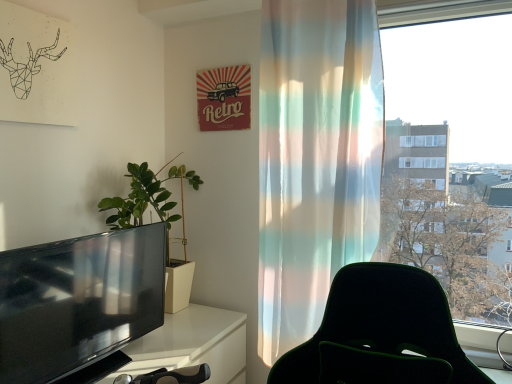
Question: Does point (53, 375) appear closer or farther from the camera than point (378, 218)?

Choices:
 (A) closer
 (B) farther

Answer: (A)

Question: From the image's perspective, is black glossy television at left positioned above or below translucent fabric curtain at right?

Choices:
 (A) below
 (B) above

Answer: (A)

Question: Which of these objects is positioned farthest from the green matte plant at left?

Choices:
 (A) translucent fabric curtain at right
 (B) black glossy television at left

Answer: (A)

Question: Estimate the real-world distances between objects in this image. Which object is closer to the green matte plant at left?

Choices:
 (A) black glossy television at left
 (B) translucent fabric curtain at right

Answer: (A)